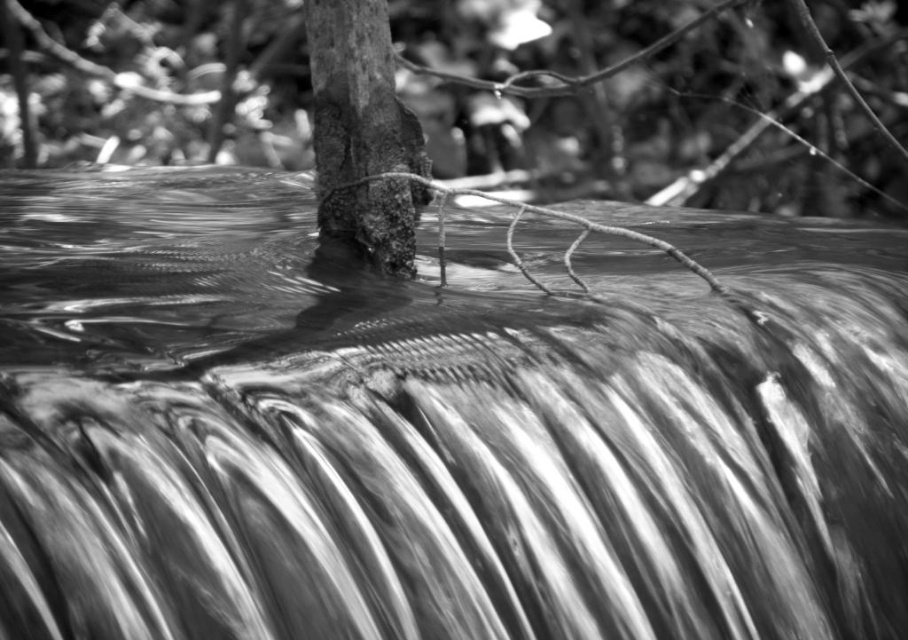
Is smooth water at center to the left of rough bark tree trunk at center from the viewer's perspective?

In fact, smooth water at center is to the right of rough bark tree trunk at center.

How far apart are smooth water at center and rough bark tree trunk at center?

smooth water at center and rough bark tree trunk at center are 39.24 inches apart from each other.

Who is more forward, (x=243, y=262) or (x=337, y=124)?

Point (x=337, y=124)

Identify the location of smooth water at center. The width and height of the screenshot is (908, 640). (442, 422).